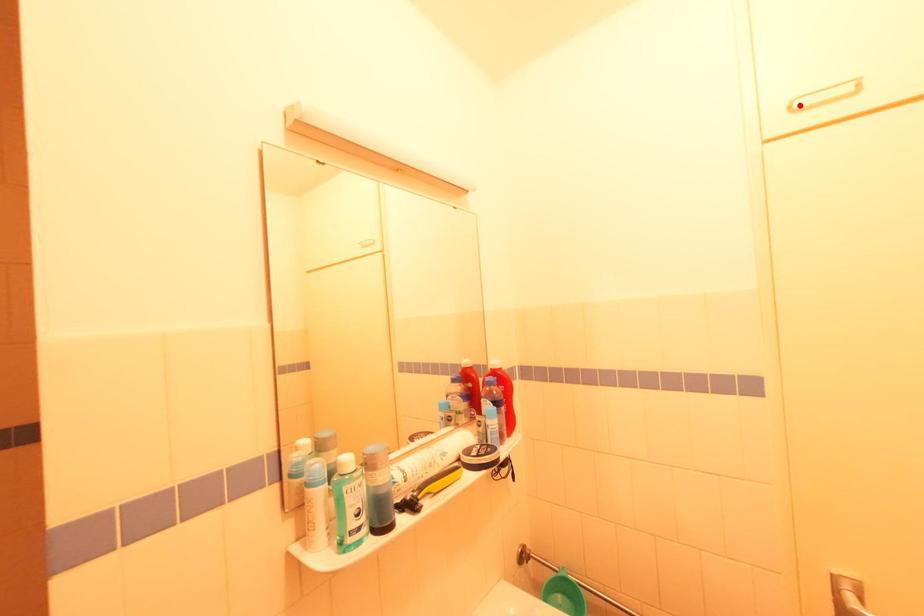
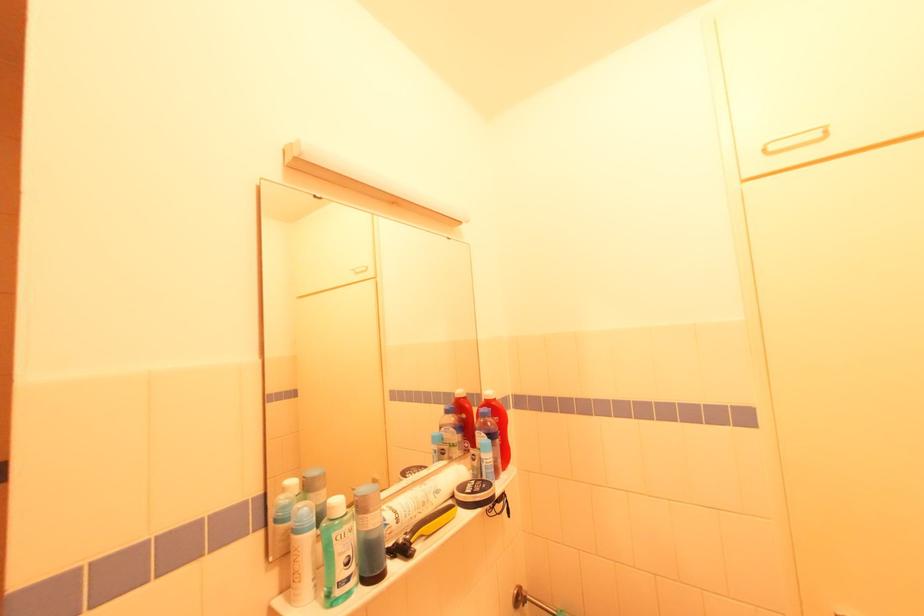
Where in the second image is the point corresponding to the highlighted location from the first image?

(773, 148)